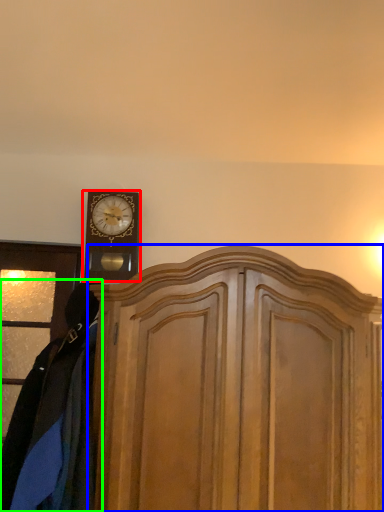
Question: Considering the real-world distances, which object is closest to wall clock (highlighted by a red box)? dresser (highlighted by a blue box) or clothing (highlighted by a green box).

Choices:
 (A) dresser
 (B) clothing

Answer: (B)